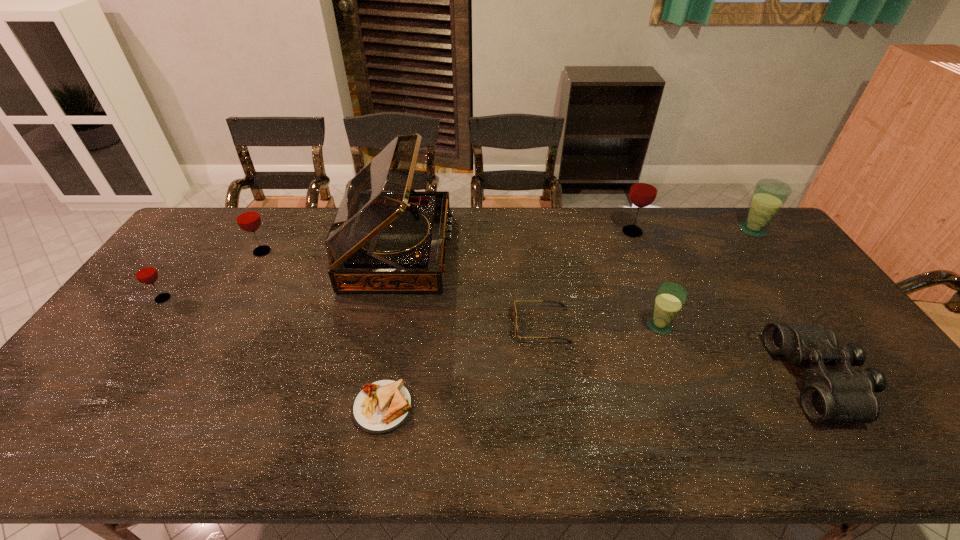
You are a GUI agent. You are given a task and a screenshot of the screen. Output one action in this format:
    pyautogui.click(x=<x>, y=<y>)
    Task: Click on the glass identified as the fourth closest to the leftmost glass
    
    Given the screenshot: What is the action you would take?
    pyautogui.click(x=769, y=195)

Point out which glass is positioned as the nearest to the black binoculars. Please provide its 2D coordinates. Your answer should be formatted as a tuple, i.e. [(x, y)], where the tuple contains the x and y coordinates of a point satisfying the conditions above.

[(670, 298)]

Identify which red glass is located as the third nearest to the tallest object. Please provide its 2D coordinates. Your answer should be formatted as a tuple, i.e. [(x, y)], where the tuple contains the x and y coordinates of a point satisfying the conditions above.

[(644, 189)]

Locate which red glass is the third closest to the bigger blue glass. Please provide its 2D coordinates. Your answer should be formatted as a tuple, i.e. [(x, y)], where the tuple contains the x and y coordinates of a point satisfying the conditions above.

[(143, 270)]

You are a GUI agent. You are given a task and a screenshot of the screen. Output one action in this format:
    pyautogui.click(x=<x>, y=<y>)
    Task: Click on the free location that satisfies the following two spatial constraints: 1. on the front-facing side of the fifth object from left to right; 2. on the right side of the nearer blue glass
    Image resolution: width=960 pixels, height=540 pixels.
    Given the screenshot: What is the action you would take?
    pyautogui.click(x=542, y=326)

Find the location of a particular element. Image resolution: width=960 pixels, height=540 pixels. free spot that satisfies the following two spatial constraints: 1. on the back side of the rightmost red glass; 2. on the right side of the farther blue glass is located at coordinates (632, 230).